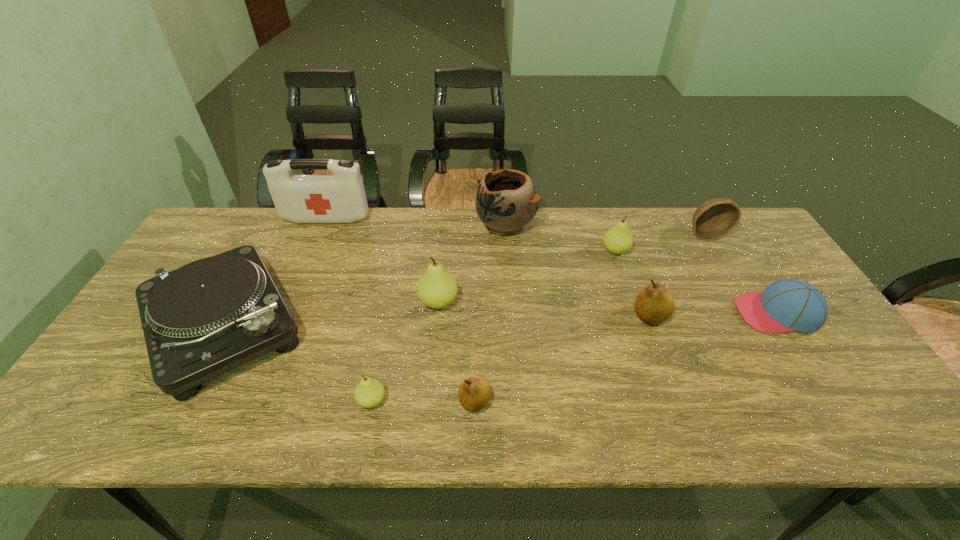
The image size is (960, 540). I want to click on red first-aid kit, so click(x=339, y=198).

What are the coordinates of `the first-aid kit` in the screenshot? It's located at (339, 198).

At what (x,y) coordinates should I click in order to perform the action: click on pottery. Please return your answer as a coordinate pair (x, y). Looking at the image, I should click on (506, 201).

The height and width of the screenshot is (540, 960). I want to click on the fourth pear from right to left, so click(436, 288).

The image size is (960, 540). What are the coordinates of `the biggest green pear` in the screenshot? It's located at (436, 288).

Locate an element on the screen. This screenshot has height=540, width=960. bowl is located at coordinates (713, 219).

The height and width of the screenshot is (540, 960). In order to click on the farthest green pear in this screenshot , I will do `click(618, 239)`.

What are the coordinates of `the second biggest green pear` in the screenshot? It's located at (618, 239).

This screenshot has height=540, width=960. Identify the location of the bigger brown pear. (654, 304).

Image resolution: width=960 pixels, height=540 pixels. In order to click on the farther brown pear in this screenshot , I will do `click(654, 304)`.